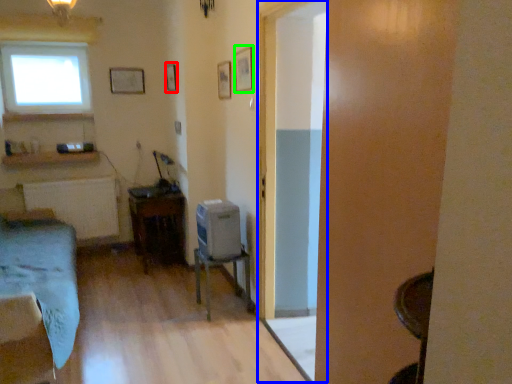
Question: Based on their relative distances, which object is farther from picture frame (highlighted by a red box)? Choose from glass door (highlighted by a blue box) and picture frame (highlighted by a green box).

Choices:
 (A) glass door
 (B) picture frame

Answer: (A)